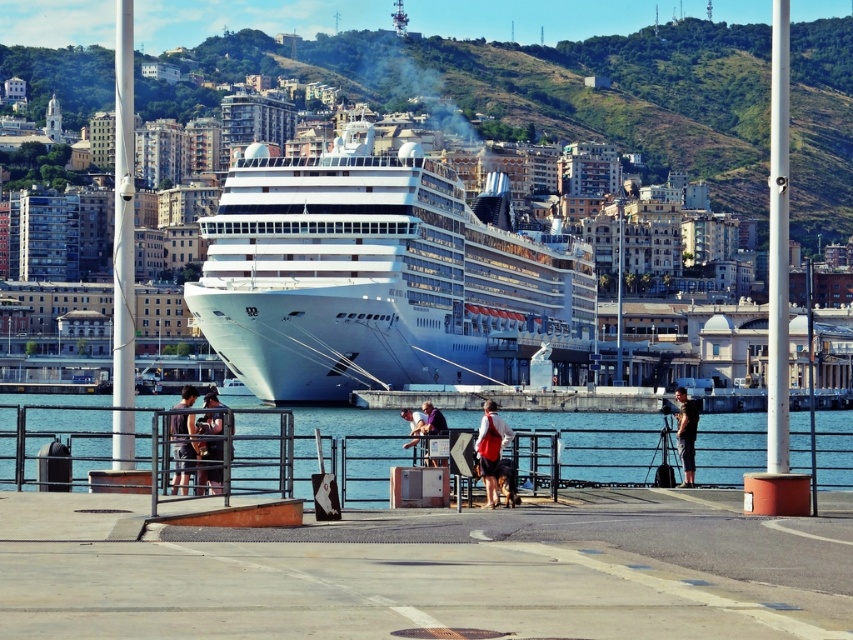
Is matte black jacket at center positioned in front of dark gray fabric shirt at center?

Yes.

This screenshot has height=640, width=853. What are the coordinates of `matte black jacket at center` in the screenshot? It's located at (209, 480).

Describe the element at coordinates (209, 480) in the screenshot. Image resolution: width=853 pixels, height=640 pixels. I see `matte black jacket at center` at that location.

Find the location of `matte black jacket at center`. matte black jacket at center is located at coordinates (209, 480).

Who is more forward, (198, 484) or (694, 406)?

Point (198, 484) is more forward.

Can you confirm if matte black jacket at center is shorter than dark blue jeans at center?

Yes, matte black jacket at center is shorter than dark blue jeans at center.

Locate an element on the screen. This screenshot has height=640, width=853. matte black jacket at center is located at coordinates (209, 480).

This screenshot has width=853, height=640. Find the location of `matte black jacket at center`. matte black jacket at center is located at coordinates 209,480.

At what (x,y) coordinates should I click in order to perform the action: click on clear blue water at lower center. Please return your answer as a coordinate pair (x, y). Looking at the image, I should click on (595, 445).

The height and width of the screenshot is (640, 853). I want to click on clear blue water at lower center, so click(595, 445).